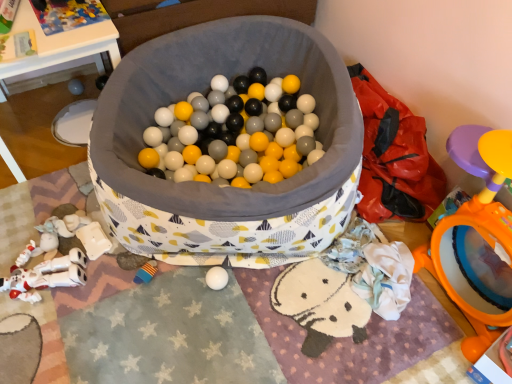
Where is `space that is in front of soft plush toy at lower left, positioned as the fourth toy in left-to-right order`? The height and width of the screenshot is (384, 512). space that is in front of soft plush toy at lower left, positioned as the fourth toy in left-to-right order is located at coordinates (136, 325).